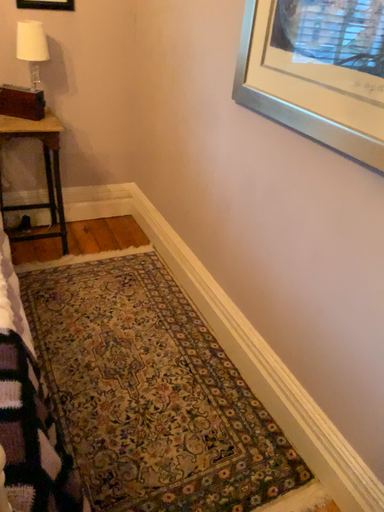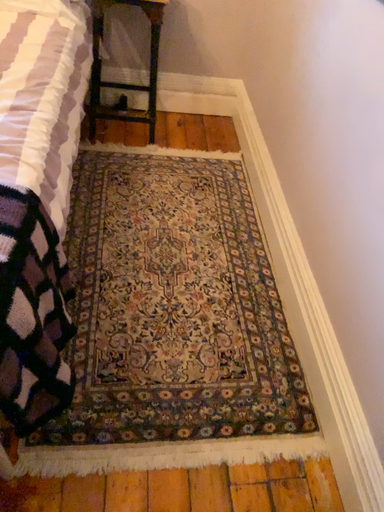
Question: How did the camera likely rotate when shooting the video?

Choices:
 (A) rotated right
 (B) rotated left

Answer: (B)